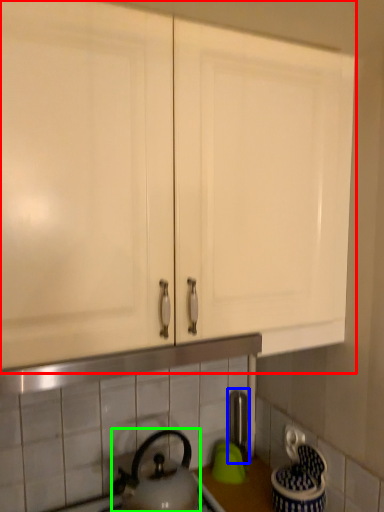
Question: Estimate the real-world distances between objects in this image. Which object is farther from cabinetry (highlighted by a red box), faucet (highlighted by a blue box) or kettle (highlighted by a green box)?

Choices:
 (A) faucet
 (B) kettle

Answer: (A)